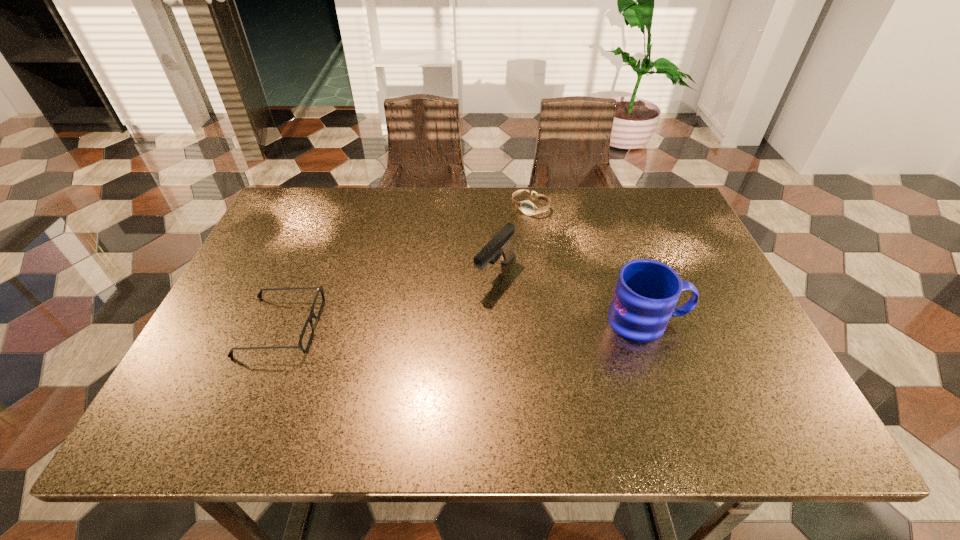
Where is `free spot located 0.050m on the face of the third object from left to right`? The image size is (960, 540). free spot located 0.050m on the face of the third object from left to right is located at coordinates (514, 225).

This screenshot has width=960, height=540. Identify the location of vacant region located on the face of the third object from left to right. (492, 250).

You are a GUI agent. You are given a task and a screenshot of the screen. Output one action in this format:
    pyautogui.click(x=<x>, y=<y>)
    Task: Click on the blank space located on the front-facing side of the third object from right to left
    
    Given the screenshot: What is the action you would take?
    pyautogui.click(x=462, y=318)

In order to click on free space located 0.310m on the front-facing side of the third object from right to left in this screenshot , I will do 405,383.

Find the location of a particular element. This screenshot has height=540, width=960. free spot located on the front-facing side of the third object from right to left is located at coordinates (405, 383).

This screenshot has height=540, width=960. I want to click on object at the far edge, so click(527, 207).

Find the location of a particular element. object present at the near edge is located at coordinates (319, 289).

Find the location of a particular element. Image resolution: width=960 pixels, height=540 pixels. object present at the left edge is located at coordinates (319, 289).

This screenshot has height=540, width=960. In order to click on object at the right edge in this screenshot , I will do `click(647, 291)`.

Where is `object at the near left corner`? object at the near left corner is located at coordinates (319, 289).